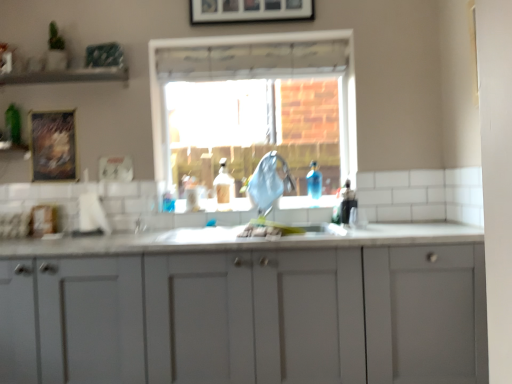
Question: From the image's perspective, is white matte cabinet at center positioned above or below blue fabric at center?

Choices:
 (A) below
 (B) above

Answer: (A)

Question: Is white matte cabinet at center inside or outside of blue fabric at center?

Choices:
 (A) outside
 (B) inside

Answer: (A)

Question: Which is farther from the white matte cabinet at center?

Choices:
 (A) wooden textured frame at upper left, the 2th picture frame viewed from the front
 (B) blue fabric at center
 (C) translucent plastic bottle at center
 (D) wooden framed picture at upper center, which is the 2th picture frame in bottom-to-top order
 (E) clear glass window at center

Answer: (D)

Question: Which object is positioned farthest from the white matte cabinet at center?

Choices:
 (A) translucent plastic bottle at center
 (B) clear glass window at center
 (C) blue fabric at center
 (D) wooden framed picture at upper center, acting as the 2th picture frame starting from the back
 (E) wooden textured frame at upper left, which is the second picture frame from right to left

Answer: (D)